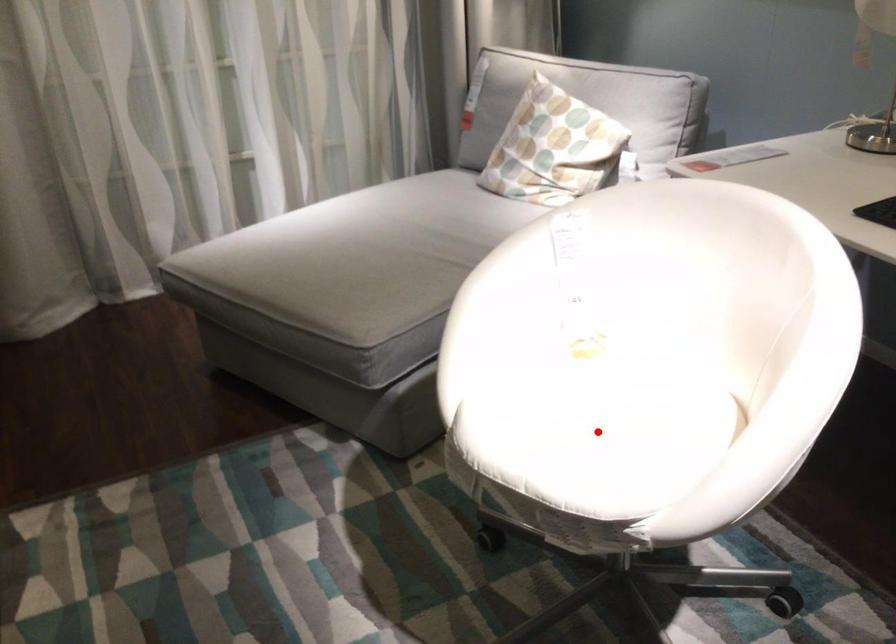
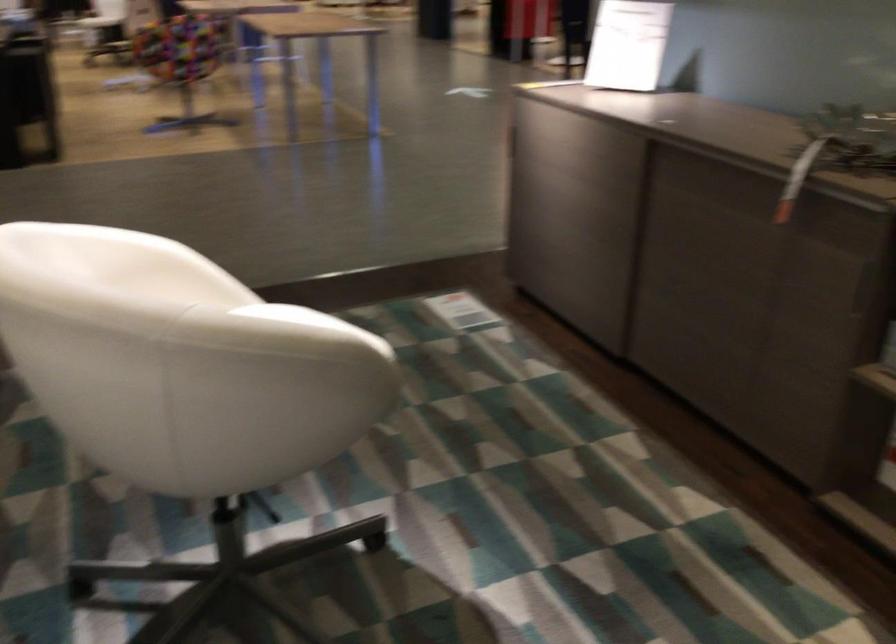
Question: I am providing you with two images of the same scene from different viewpoints. A red point is marked on the first image. At the location where the point appears in image 1, is it still visible in image 2?

Choices:
 (A) Yes
 (B) No

Answer: (B)